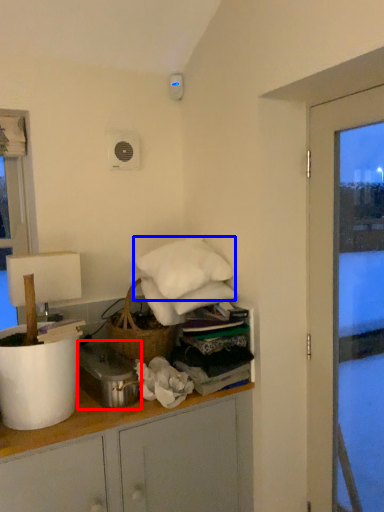
Question: Among these objects, which one is nearest to the camera, appliance (highlighted by a red box) or pillow (highlighted by a blue box)?

Choices:
 (A) appliance
 (B) pillow

Answer: (A)